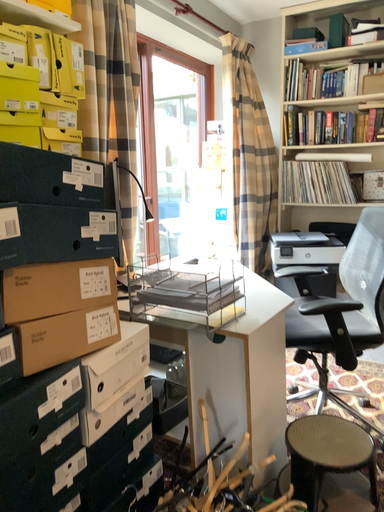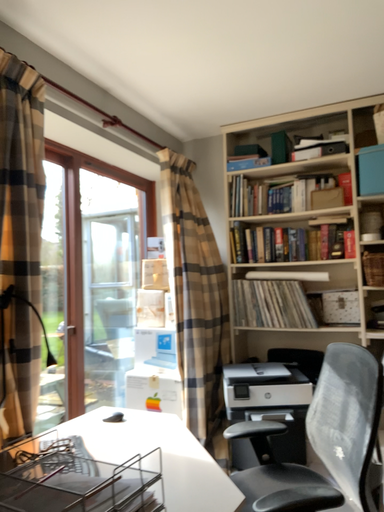
Question: Which way did the camera rotate in the video?

Choices:
 (A) rotated downward
 (B) rotated upward

Answer: (B)